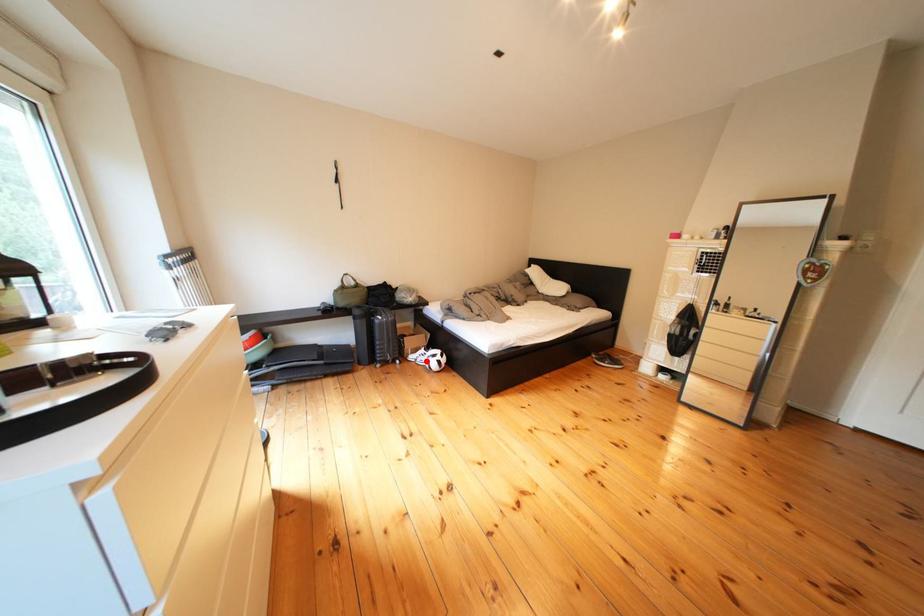
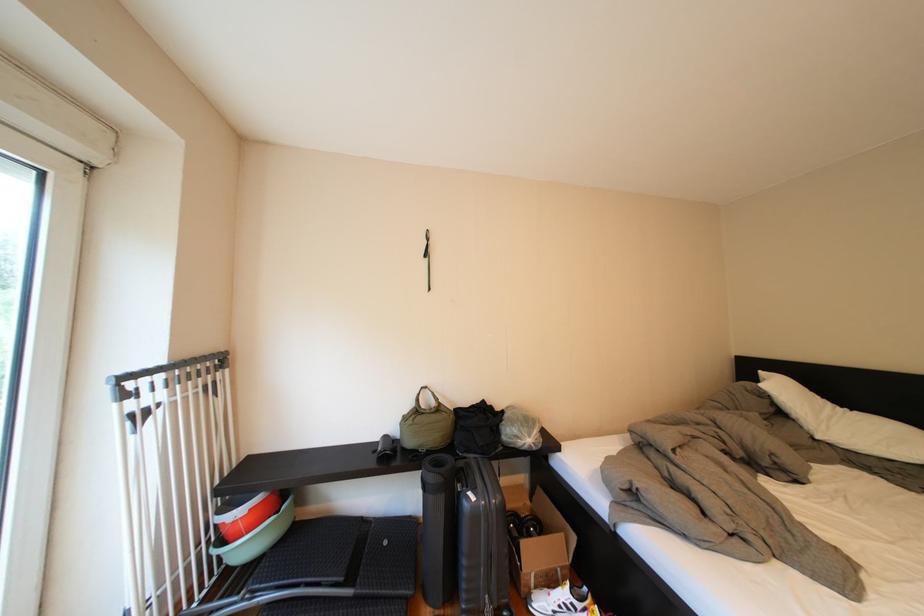
Find the pixel in the second image that matches the highlighted location in the first image.

(554, 609)